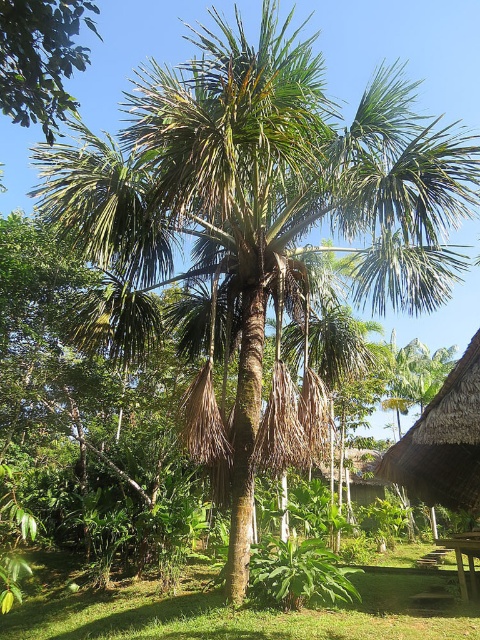
Question: Which object appears closest to the camera in this image?

Choices:
 (A) green grass at center
 (B) wooden picnic table at lower right
 (C) green leafy tree at upper left
 (D) thatched roof hut at lower right

Answer: (C)

Question: Which object is the closest to the green leafy tree at upper left?

Choices:
 (A) thatched roof hut at lower right
 (B) wooden picnic table at lower right

Answer: (A)

Question: Does thatched roof hut at lower right have a smaller size compared to wooden picnic table at lower right?

Choices:
 (A) yes
 (B) no

Answer: (B)

Question: Which of the following is the farthest from the observer?

Choices:
 (A) green grass at center
 (B) green leafy tree at upper left

Answer: (A)

Question: Observing the image, what is the correct spatial positioning of thatched roof hut at lower right in reference to wooden picnic table at lower right?

Choices:
 (A) below
 (B) above

Answer: (B)

Question: Can you confirm if green grass at center is positioned to the left of wooden picnic table at lower right?

Choices:
 (A) no
 (B) yes

Answer: (B)